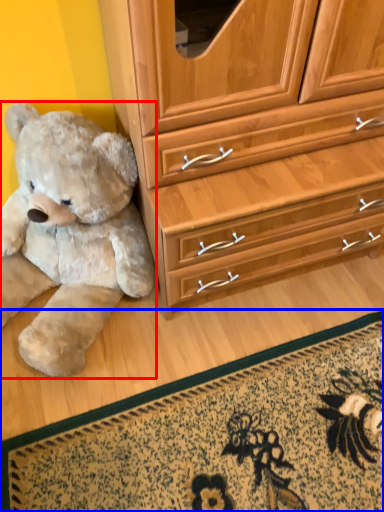
Question: Which object appears farthest to the camera in this image, teddy bear (highlighted by a red box) or doormat (highlighted by a blue box)?

Choices:
 (A) teddy bear
 (B) doormat

Answer: (B)